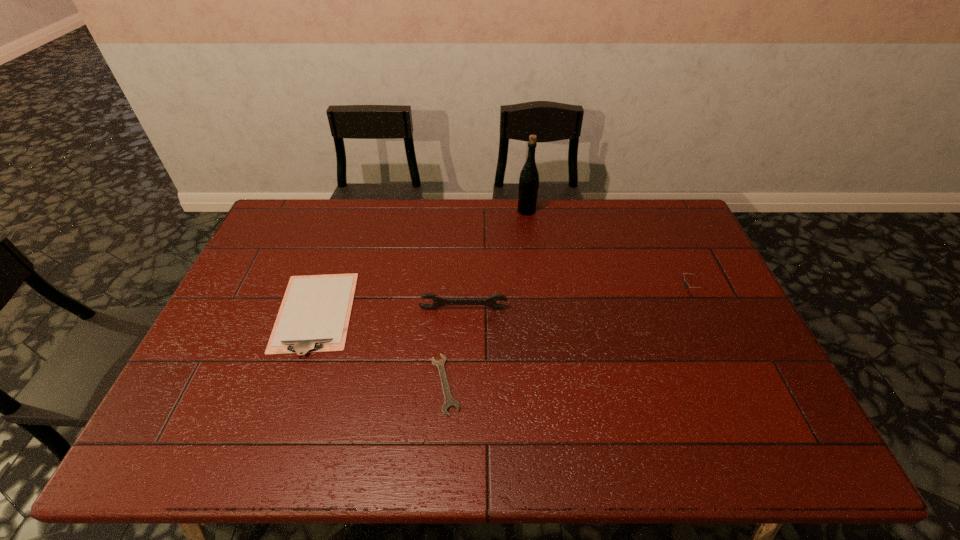
I want to click on vacant region located 0.300m in front of the lenses of the rightmost object, so click(579, 293).

I want to click on vacant point located 0.060m in front of the lenses of the rightmost object, so click(659, 293).

Locate an element on the screen. The width and height of the screenshot is (960, 540). vacant area situated 0.390m on the open ends of the taller wrench is located at coordinates (459, 440).

The width and height of the screenshot is (960, 540). Identify the location of vacant position located on the back of the leftmost object. (336, 253).

Identify the location of free point located on the left of the shorter wrench. (330, 384).

At what (x,y) coordinates should I click in order to perform the action: click on object at the far edge. Please return your answer as a coordinate pair (x, y). The width and height of the screenshot is (960, 540). Looking at the image, I should click on (529, 177).

What are the coordinates of `object located at the left edge` in the screenshot? It's located at (314, 316).

The height and width of the screenshot is (540, 960). Identify the location of object positioned at the right edge. pos(686,284).

What are the coordinates of `free space at the far edge` in the screenshot? It's located at (620, 221).

Where is `free region at the left edge of the desktop`? This screenshot has width=960, height=540. free region at the left edge of the desktop is located at coordinates (228, 326).